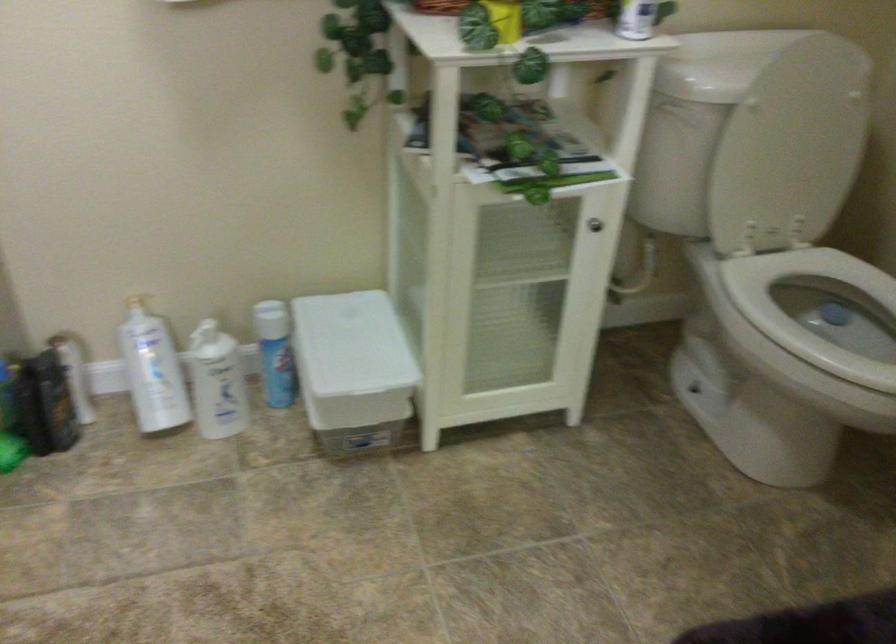
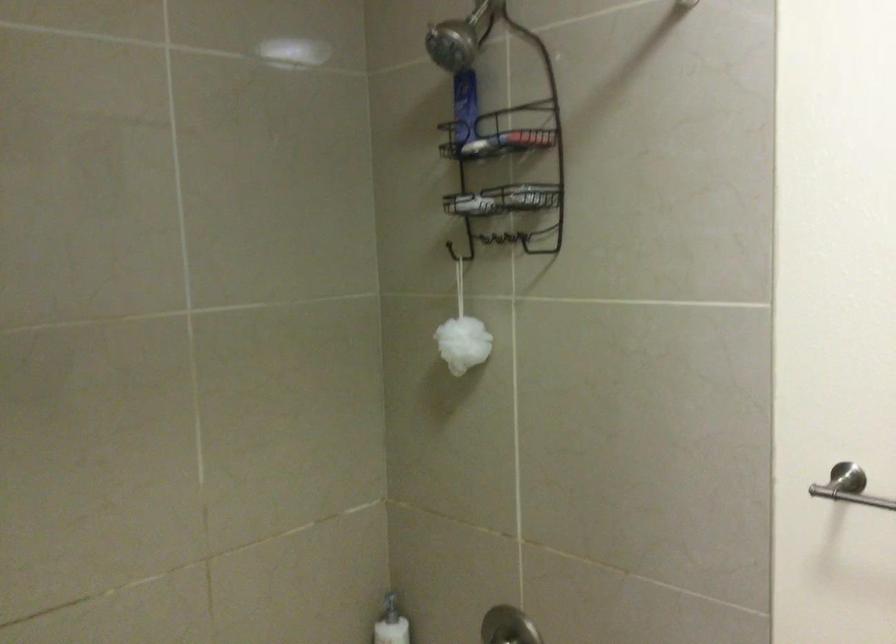
Question: The first image is from the beginning of the video and the second image is from the end. How did the camera likely rotate when shooting the video?

Choices:
 (A) Left
 (B) Right
 (C) Up
 (D) Down

Answer: (A)